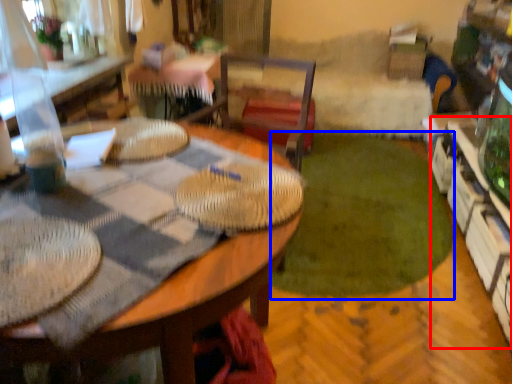
Question: Which point is further to the camera, shelf (highlighted by a red box) or grass (highlighted by a blue box)?

Choices:
 (A) shelf
 (B) grass

Answer: (B)